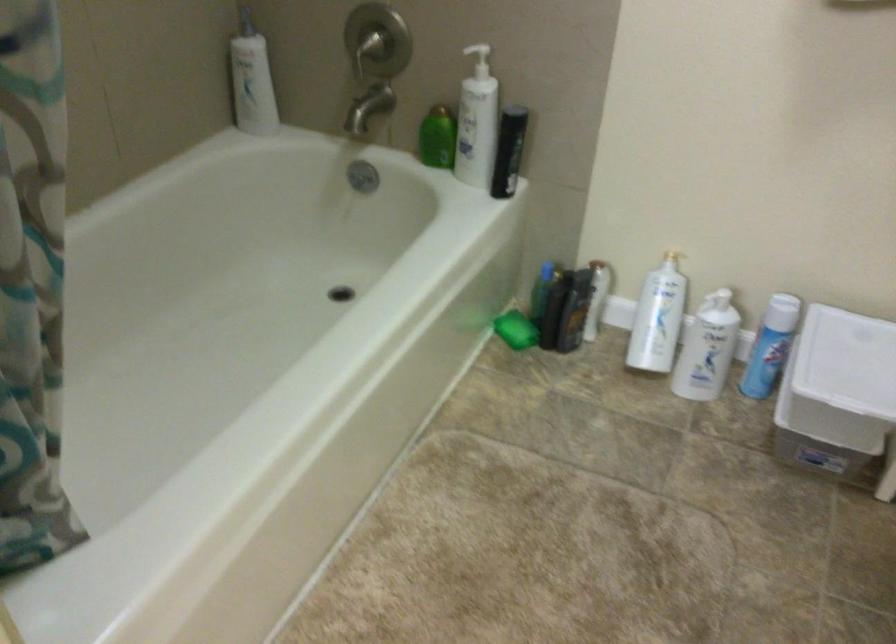
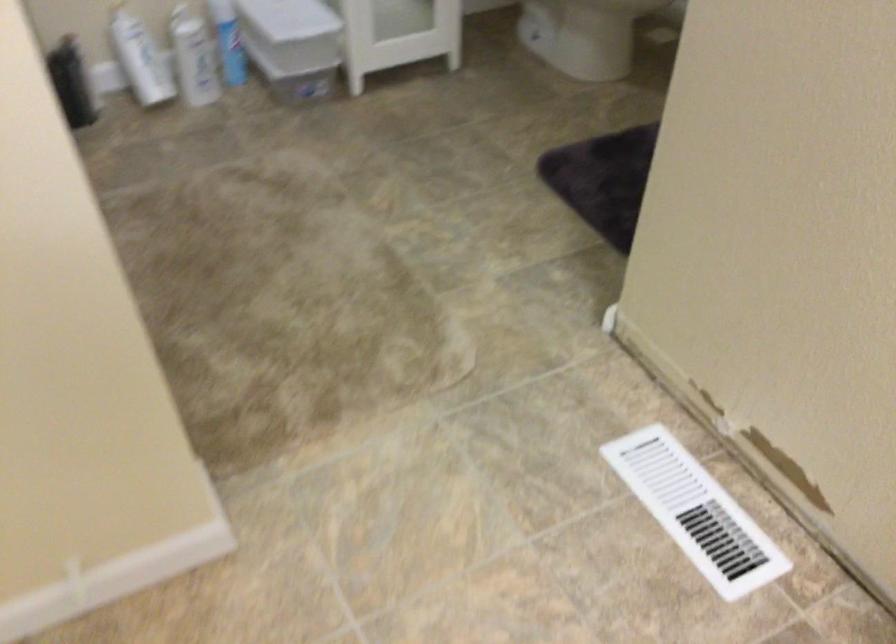
In the second image, find the point that corresponds to (x=824, y=383) in the first image.

(293, 32)